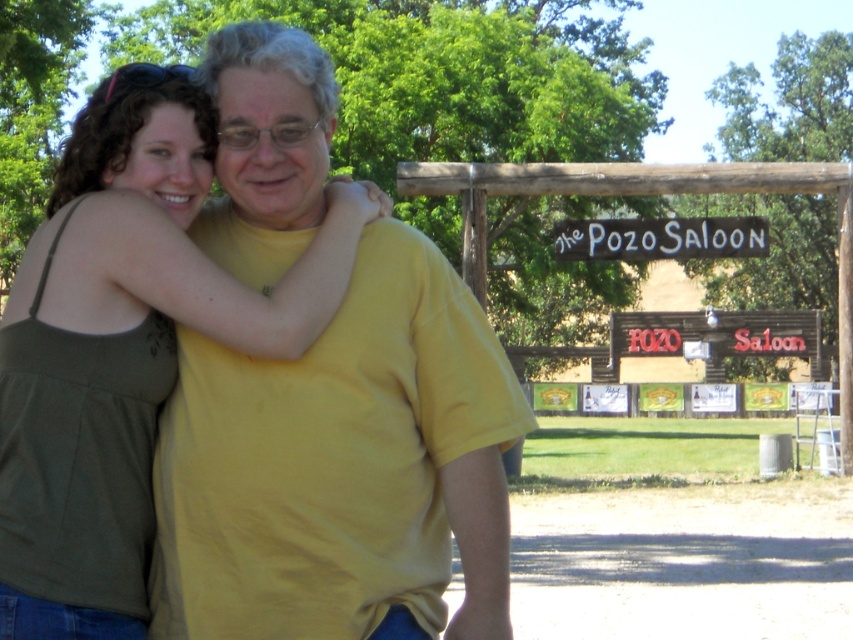
Does yellow matte t-shirt at center appear on the right side of matte green tank top at left?

Indeed, yellow matte t-shirt at center is positioned on the right side of matte green tank top at left.

Between point (236, 552) and point (190, 147), which one is positioned in front?

Point (236, 552) is more forward.

Where is `yellow matte t-shirt at center`? Image resolution: width=853 pixels, height=640 pixels. yellow matte t-shirt at center is located at coordinates (341, 468).